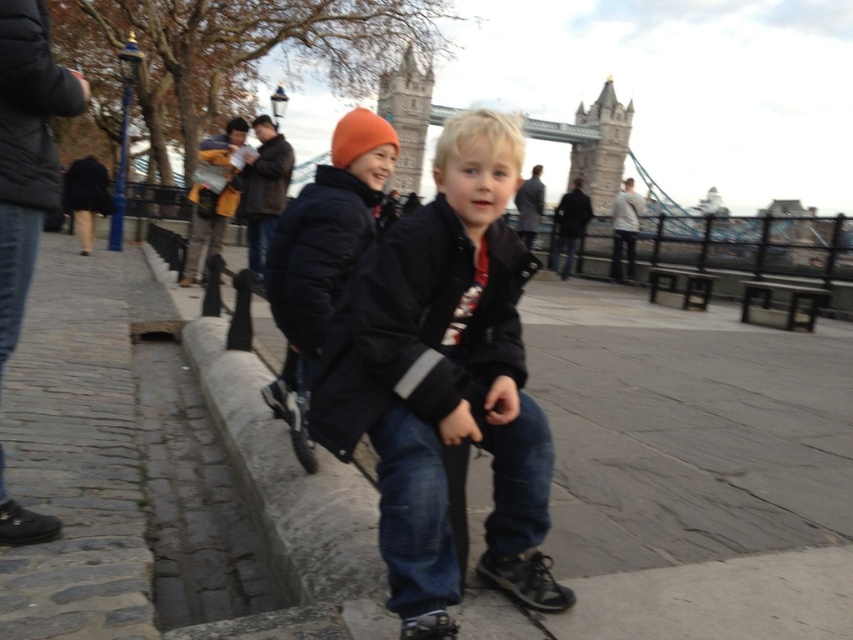
Is smooth concrete pavement at center bigger than stone tower bridge at center?

No, smooth concrete pavement at center is not bigger than stone tower bridge at center.

Is smooth concrete pavement at center above stone tower bridge at center?

No.

Consider the image. Who is more distant from viewer, [267,538] or [428,83]?

Positioned behind is point [428,83].

Find the location of a particular element. The width and height of the screenshot is (853, 640). smooth concrete pavement at center is located at coordinates (685, 476).

Is smooth concrete pavement at center shorter than matte black jacket at center?

Yes, smooth concrete pavement at center is shorter than matte black jacket at center.

Does smooth concrete pavement at center have a greater width compared to matte black jacket at center?

Yes, smooth concrete pavement at center is wider than matte black jacket at center.

Does point (682, 369) come closer to viewer compared to point (459, 316)?

No, it is not.

Locate an element on the screen. smooth concrete pavement at center is located at coordinates (685, 476).

Which is in front, point (410, 385) or point (407, 115)?

Positioned in front is point (410, 385).

Can you confirm if black matte jacket at center is smaller than stone tower bridge at center?

Yes, black matte jacket at center is smaller than stone tower bridge at center.

I want to click on black matte jacket at center, so click(x=421, y=326).

Locate an element on the screen. The image size is (853, 640). black matte jacket at center is located at coordinates (421, 326).